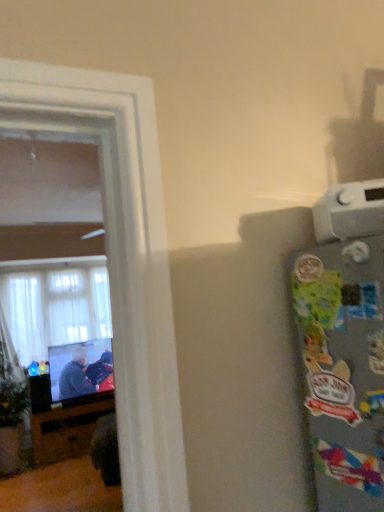
Question: From a real-world perspective, relative to white sheer curtains at left, is white plastic thermostat at upper right vertically above or below?

Choices:
 (A) above
 (B) below

Answer: (A)

Question: Does point (332, 220) appear closer or farther from the camera than point (64, 287)?

Choices:
 (A) farther
 (B) closer

Answer: (B)

Question: Considering the real-world distances, which object is closest to the dark gray sweater at left?

Choices:
 (A) white plastic thermostat at upper right
 (B) white sheer curtains at left
 (C) black glossy entertainment center at left
 (D) green matte plant at left

Answer: (C)

Question: Estimate the real-world distances between objects in this image. Which object is farther from the green matte plant at left?

Choices:
 (A) white plastic thermostat at upper right
 (B) dark gray sweater at left
 (C) black glossy entertainment center at left
 (D) white sheer curtains at left

Answer: (A)